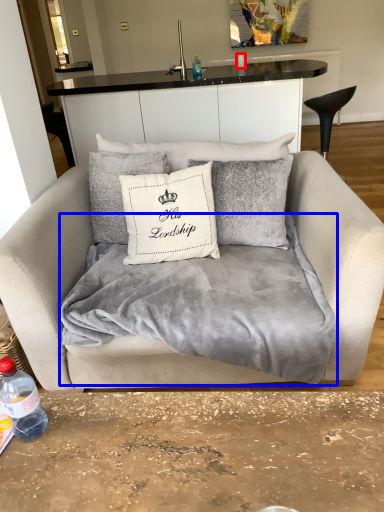
Question: Which of the following is the closest to the observer, coffee cup (highlighted by a red box) or blanket (highlighted by a blue box)?

Choices:
 (A) coffee cup
 (B) blanket

Answer: (B)